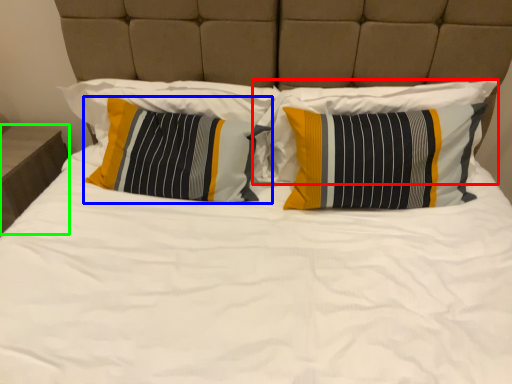
Question: Which object is the farthest from pillow (highlighted by a red box)? Choose among these: pillow (highlighted by a blue box) or nightstand (highlighted by a green box).

Choices:
 (A) pillow
 (B) nightstand

Answer: (B)